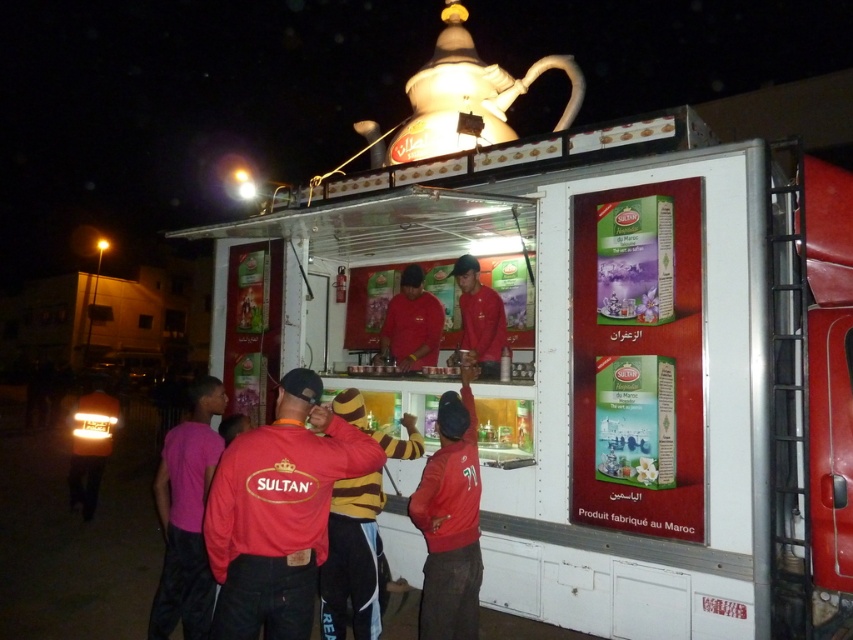
You are a customer standing in front of the white plastic trailer truck at center and the matte red shirt at center. Which object is bigger in size?

The white plastic trailer truck at center is larger in size compared to the matte red shirt at center.

You are a customer waiting in line at the Sultan food truck. You notice two staff members wearing red clothing at the counter. Which staff member is wearing an item with a wider width? The options are the red matte jacket at center and the matte red shirt at center.

The red matte jacket at center has a greater width than the matte red shirt at center, so the staff member wearing the red matte jacket at center has a wider item.